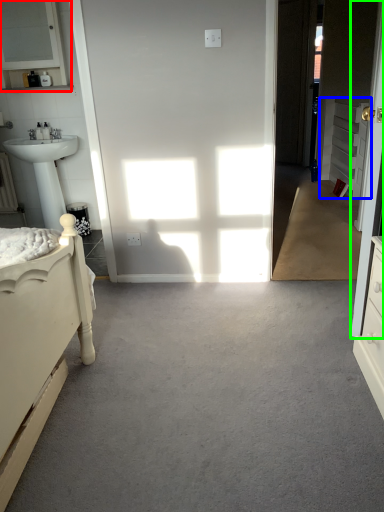
Question: Based on their relative distances, which object is farther from medicine cabinet (highlighted by a red box)? Choose from cabinetry (highlighted by a blue box) and door (highlighted by a green box).

Choices:
 (A) cabinetry
 (B) door

Answer: (A)